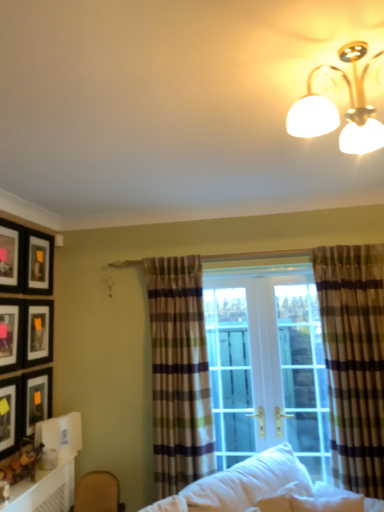
At what (x,y) coordinates should I click in order to perform the action: click on free point above gold metallic light fixture at upper right (from a real-world perspective). Please return your answer as a coordinate pair (x, y). Image resolution: width=384 pixels, height=512 pixels. Looking at the image, I should click on (328, 61).